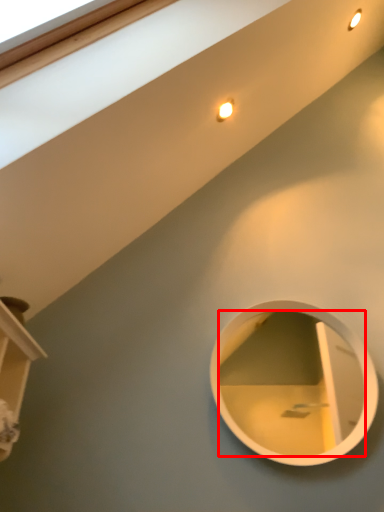
Question: Observing the image, what is the correct spatial positioning of mirror (annotated by the red box) in reference to shelf?

Choices:
 (A) right
 (B) left

Answer: (A)